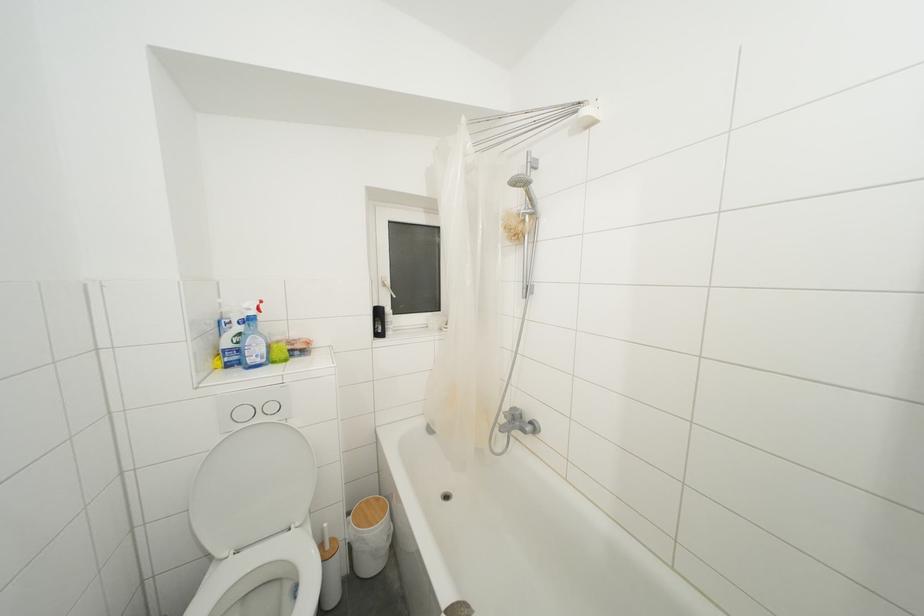
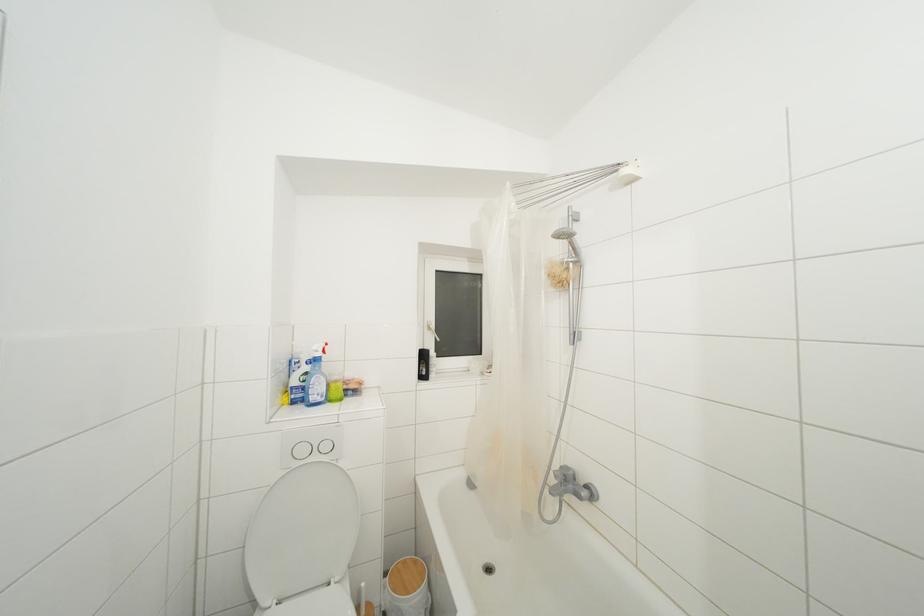
Which direction would the cameraman need to move to produce the second image?

The cameraman moved toward left, backward.